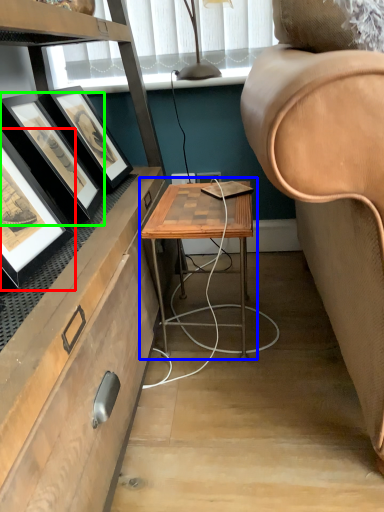
Question: Considering the real-world distances, which object is farthest from picture frame (highlighted by a red box)? table (highlighted by a blue box) or picture frame (highlighted by a green box)?

Choices:
 (A) table
 (B) picture frame

Answer: (A)